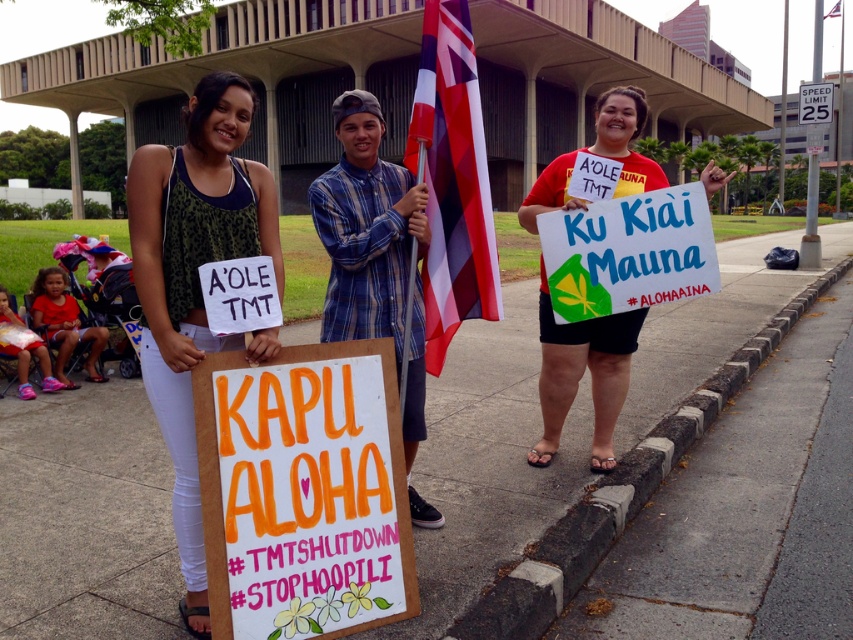
Can you confirm if hand-painted cardboard sign at center is positioned to the left of red matte sign at center?

Correct, you'll find hand-painted cardboard sign at center to the left of red matte sign at center.

Who is more forward, [238,557] or [543,448]?

Point [238,557] is in front.

Find the location of a particular element. The height and width of the screenshot is (640, 853). hand-painted cardboard sign at center is located at coordinates (303, 492).

In the scene shown: Is the position of blue plaid shirt at center less distant than that of red fabric flag at center?

Yes.

Can you confirm if blue plaid shirt at center is positioned to the left of red fabric flag at center?

Indeed, blue plaid shirt at center is positioned on the left side of red fabric flag at center.

What do you see at coordinates (366, 227) in the screenshot? The height and width of the screenshot is (640, 853). I see `blue plaid shirt at center` at bounding box center [366, 227].

Where is `blue plaid shirt at center`? blue plaid shirt at center is located at coordinates (366, 227).

Who is positioned more to the left, red fabric flag at center or gray concrete curb at lower right?

From the viewer's perspective, red fabric flag at center appears more on the left side.

Does red fabric flag at center appear over gray concrete curb at lower right?

Yes, red fabric flag at center is above gray concrete curb at lower right.

Is point (451, 268) behind point (741, 371)?

No, it is in front of (741, 371).

Locate an element on the screen. The width and height of the screenshot is (853, 640). red fabric flag at center is located at coordinates (451, 180).